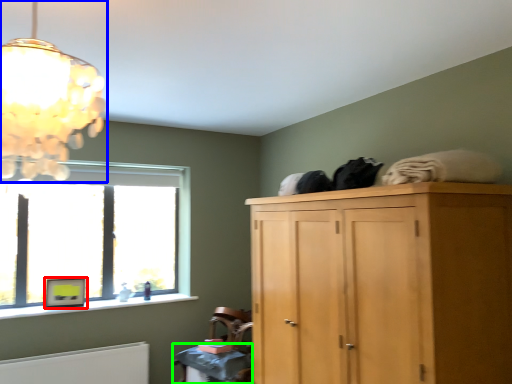
Question: Based on their relative distances, which object is farther from picture frame (highlighted by a red box)? Choose from lamp (highlighted by a blue box) and table (highlighted by a green box).

Choices:
 (A) lamp
 (B) table

Answer: (A)